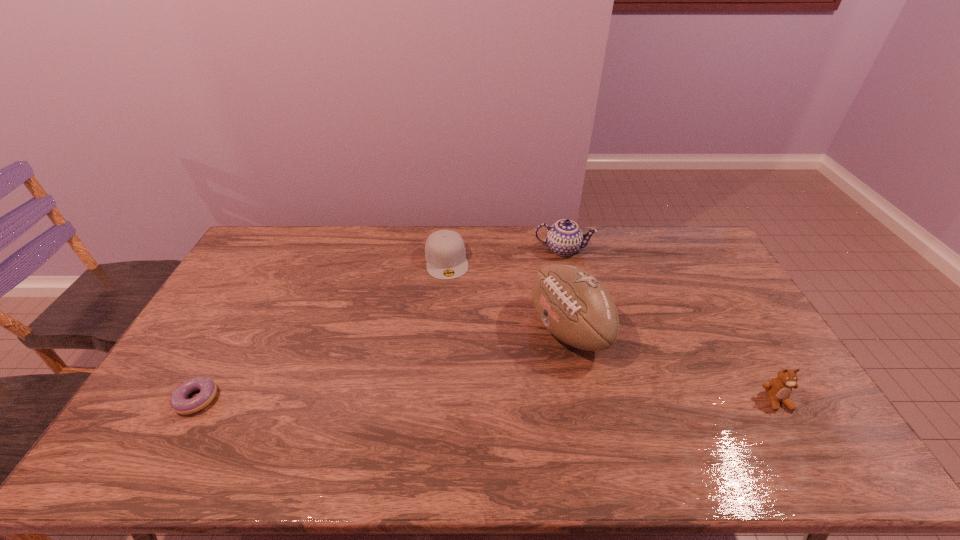
The width and height of the screenshot is (960, 540). Find the location of `object that stands as the fourth closest to the second tallest object`. object that stands as the fourth closest to the second tallest object is located at coordinates (179, 403).

Locate an element on the screen. Image resolution: width=960 pixels, height=540 pixels. free location that satisfies the following two spatial constraints: 1. on the back side of the chinaware; 2. on the right side of the third farthest object is located at coordinates (553, 249).

Where is `vacant region that satisfies the following two spatial constraints: 1. on the front side of the tallest object; 2. on the left side of the cap`? The image size is (960, 540). vacant region that satisfies the following two spatial constraints: 1. on the front side of the tallest object; 2. on the left side of the cap is located at coordinates (441, 329).